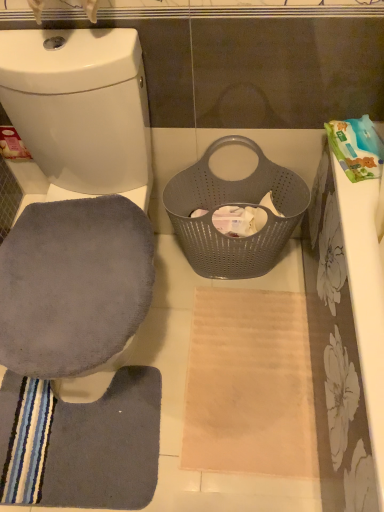
Question: From the image's perspective, is gray suede swivel chair at left below gray fabric toilet seat at left?

Choices:
 (A) yes
 (B) no

Answer: (A)

Question: Is gray suede swivel chair at left closer to the viewer compared to gray fabric toilet seat at left?

Choices:
 (A) yes
 (B) no

Answer: (B)

Question: Can gray fabric toilet seat at left be found inside gray suede swivel chair at left?

Choices:
 (A) yes
 (B) no

Answer: (B)

Question: Is gray suede swivel chair at left not within gray fabric toilet seat at left?

Choices:
 (A) yes
 (B) no

Answer: (B)

Question: From the image's perspective, is gray suede swivel chair at left on gray fabric toilet seat at left?

Choices:
 (A) no
 (B) yes

Answer: (A)

Question: From the image's perspective, is gray suede swivel chair at left above or below gray perforated basket at center?

Choices:
 (A) below
 (B) above

Answer: (A)

Question: Would you say gray suede swivel chair at left is to the left or to the right of gray perforated basket at center in the picture?

Choices:
 (A) right
 (B) left

Answer: (B)

Question: Would you say gray suede swivel chair at left is inside or outside gray perforated basket at center?

Choices:
 (A) outside
 (B) inside

Answer: (A)

Question: From a real-world perspective, is gray suede swivel chair at left positioned above or below gray perforated basket at center?

Choices:
 (A) below
 (B) above

Answer: (B)

Question: Is gray soft mat at lower left situated inside white fabric toilet paper at center or outside?

Choices:
 (A) outside
 (B) inside

Answer: (A)

Question: Looking at their shapes, would you say gray soft mat at lower left is wider or thinner than white fabric toilet paper at center?

Choices:
 (A) thin
 (B) wide

Answer: (B)

Question: Is point (48, 426) closer or farther from the camera than point (215, 209)?

Choices:
 (A) closer
 (B) farther

Answer: (A)

Question: Considering the positions of gray soft mat at lower left and white fabric toilet paper at center in the image, is gray soft mat at lower left taller or shorter than white fabric toilet paper at center?

Choices:
 (A) short
 (B) tall

Answer: (A)

Question: Would you say gray suede swivel chair at left is to the left or to the right of gray soft mat at lower left in the picture?

Choices:
 (A) right
 (B) left

Answer: (A)

Question: Considering the positions of point (49, 273) and point (148, 432), is point (49, 273) closer or farther from the camera than point (148, 432)?

Choices:
 (A) closer
 (B) farther

Answer: (A)